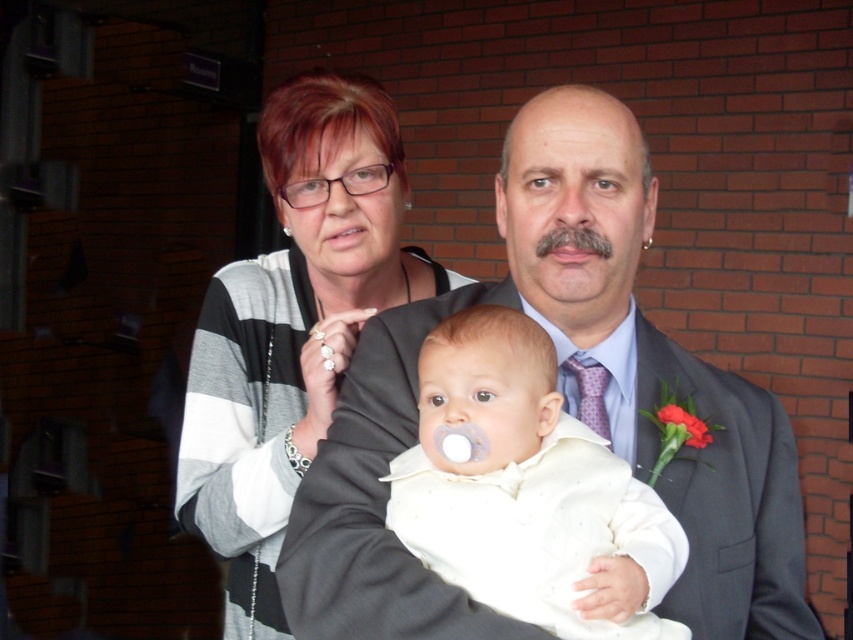
Question: Does gray striped sweater at center have a lesser width compared to white satin baby at center?

Choices:
 (A) yes
 (B) no

Answer: (B)

Question: Which point is closer to the camera?

Choices:
 (A) gray striped sweater at center
 (B) white plastic teething ring at upper center

Answer: (A)

Question: In this image, where is matte gray suit at center located relative to white plastic teething ring at upper center?

Choices:
 (A) left
 (B) right

Answer: (B)

Question: Can you confirm if white satin baby at center is bigger than white plastic teething ring at upper center?

Choices:
 (A) yes
 (B) no

Answer: (A)

Question: Which point is closer to the camera?

Choices:
 (A) gray striped sweater at center
 (B) white plastic teething ring at upper center
 (C) matte gray suit at center

Answer: (C)

Question: Based on their relative distances, which object is nearer to the white satin baby at center?

Choices:
 (A) matte gray suit at center
 (B) gray striped sweater at center

Answer: (A)